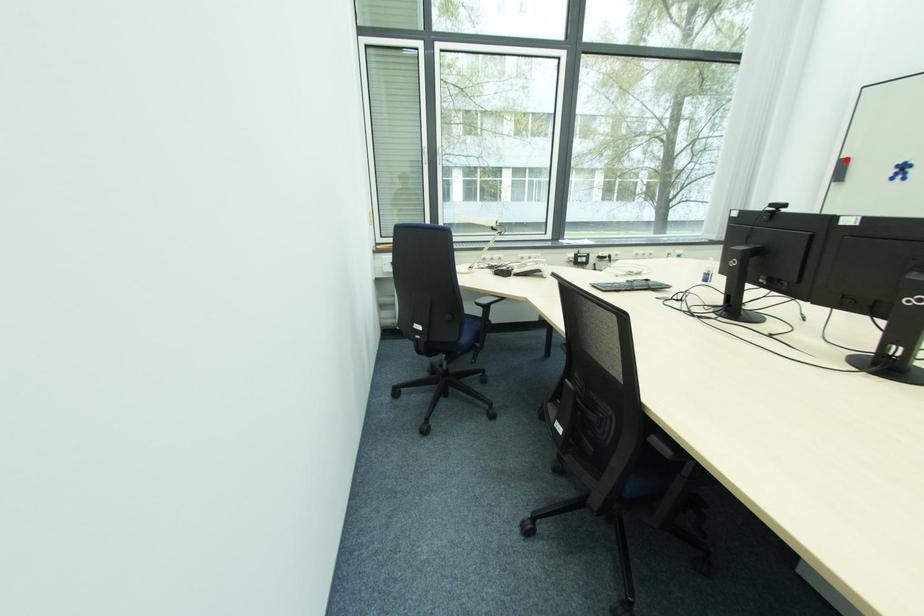
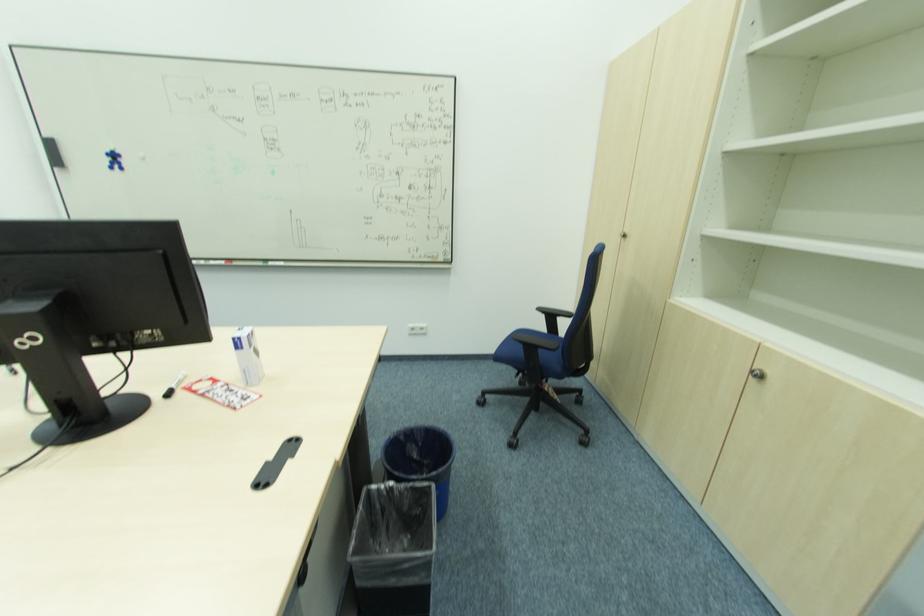
Question: I am providing you with two images of the same scene from different viewpoints. Given a red point in image1, look at the same physical point in image2. Is it:

Choices:
 (A) Closer to the viewpoint
 (B) Farther from the viewpoint

Answer: (B)